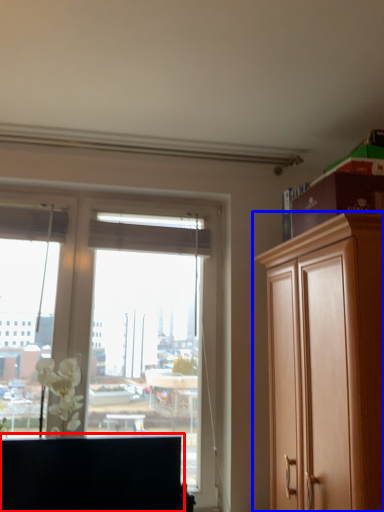
Question: Which point is closer to the camera, cabinetry (highlighted by a red box) or cabinetry (highlighted by a blue box)?

Choices:
 (A) cabinetry
 (B) cabinetry

Answer: (B)